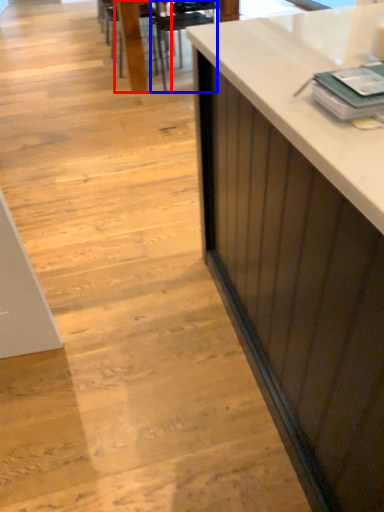
Question: Which of the following is the closest to the observer, chair (highlighted by a red box) or armchair (highlighted by a blue box)?

Choices:
 (A) chair
 (B) armchair

Answer: (B)